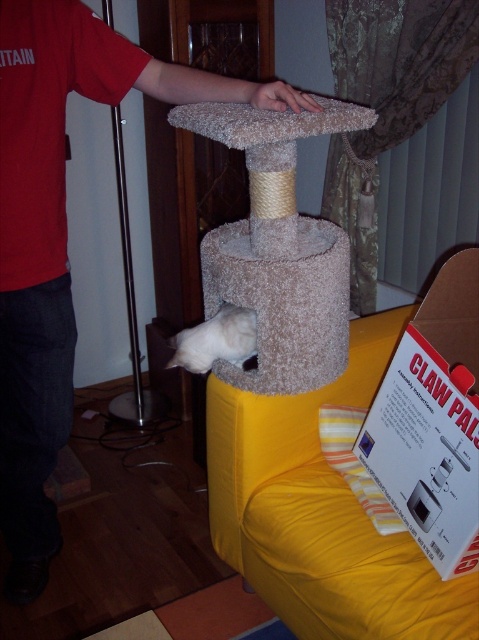
Who is more forward, (16, 436) or (225, 337)?

Point (225, 337)

Between red cotton shirt at upper left and white fluffy cat at lower center, which one has more height?

red cotton shirt at upper left is taller.

Which is behind, point (55, 296) or point (205, 352)?

The point (205, 352) is more distant.

Find the location of a particular element. Image resolution: width=479 pixels, height=640 pixels. red cotton shirt at upper left is located at coordinates (58, 237).